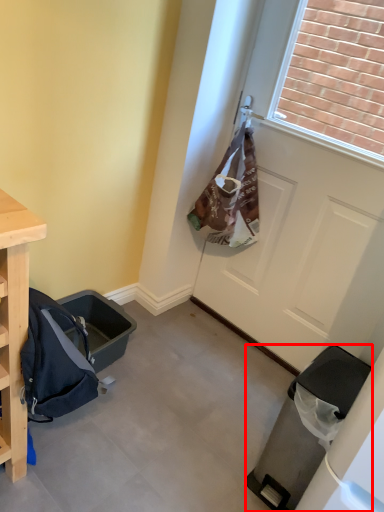
Question: Where is trash bin/can (annotated by the red box) located in relation to door in the image?

Choices:
 (A) left
 (B) right

Answer: (A)